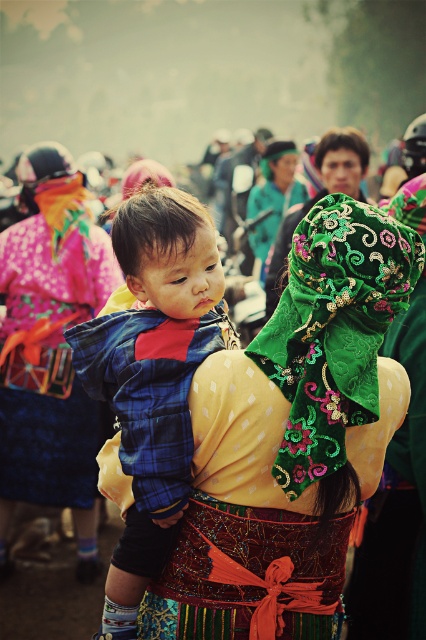
Is embroidered silk headscarf at center to the right of blue plaid shirt at center from the viewer's perspective?

Yes, embroidered silk headscarf at center is to the right of blue plaid shirt at center.

Can you confirm if embroidered silk headscarf at center is bigger than blue plaid shirt at center?

Correct, embroidered silk headscarf at center is larger in size than blue plaid shirt at center.

Is point (377, 292) more distant than point (115, 250)?

No.

Find the location of a particular element. embroidered silk headscarf at center is located at coordinates (293, 442).

Is point (58, 333) more distant than point (293, 150)?

No, it is in front of (293, 150).

Who is taller, matte blue shirt at center or green embroidered fabric at upper center?

matte blue shirt at center

Who is more forward, (111, 266) or (290, 140)?

Point (111, 266) is in front.

The image size is (426, 640). What are the coordinates of `matte blue shirt at center` in the screenshot? It's located at (51, 348).

Who is higher up, embroidered silk headscarf at center or matte blue shirt at center?

matte blue shirt at center is higher up.

At what (x,y) coordinates should I click in order to perform the action: click on embroidered silk headscarf at center. Please return your answer as a coordinate pair (x, y). Looking at the image, I should click on click(293, 442).